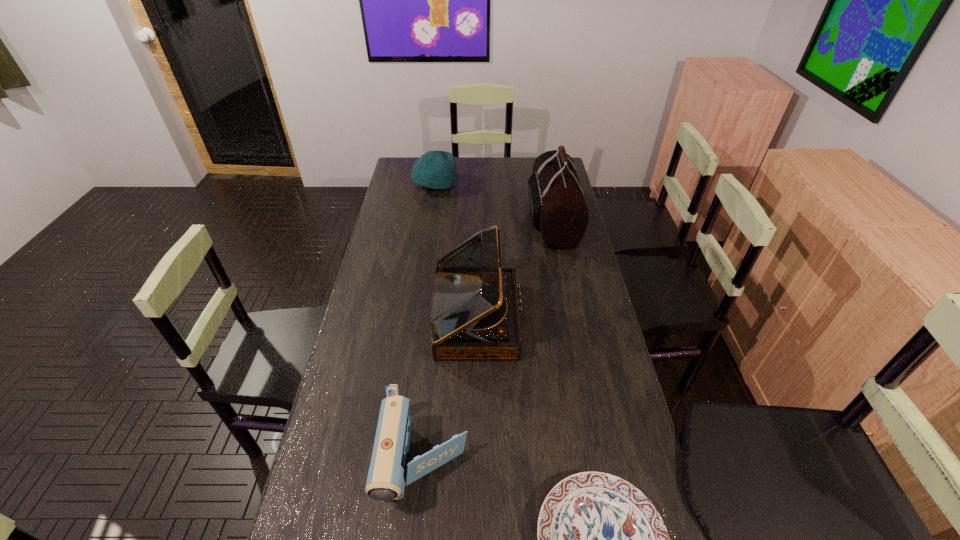
Identify the location of vacant area between the duffel bag and the beanie. (493, 201).

This screenshot has height=540, width=960. I want to click on vacant area between the beanie and the camcorder, so click(429, 322).

Identify which object is the nearest to the shortest object. Please provide its 2D coordinates. Your answer should be formatted as a tuple, i.e. [(x, y)], where the tuple contains the x and y coordinates of a point satisfying the conditions above.

[(389, 471)]

This screenshot has height=540, width=960. What are the coordinates of `object that can be found as the closest to the second tallest object` in the screenshot? It's located at (389, 471).

This screenshot has width=960, height=540. Find the location of `free space that satisfies the following two spatial constraints: 1. on the front-facing side of the fourth shortest object; 2. on the side of the camcorder with the flip-out screen`. free space that satisfies the following two spatial constraints: 1. on the front-facing side of the fourth shortest object; 2. on the side of the camcorder with the flip-out screen is located at coordinates (476, 461).